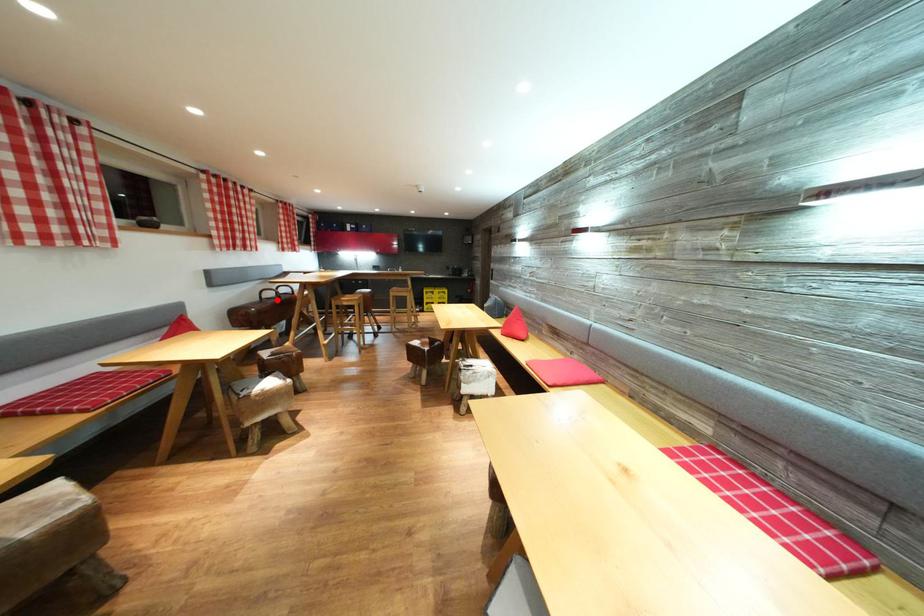
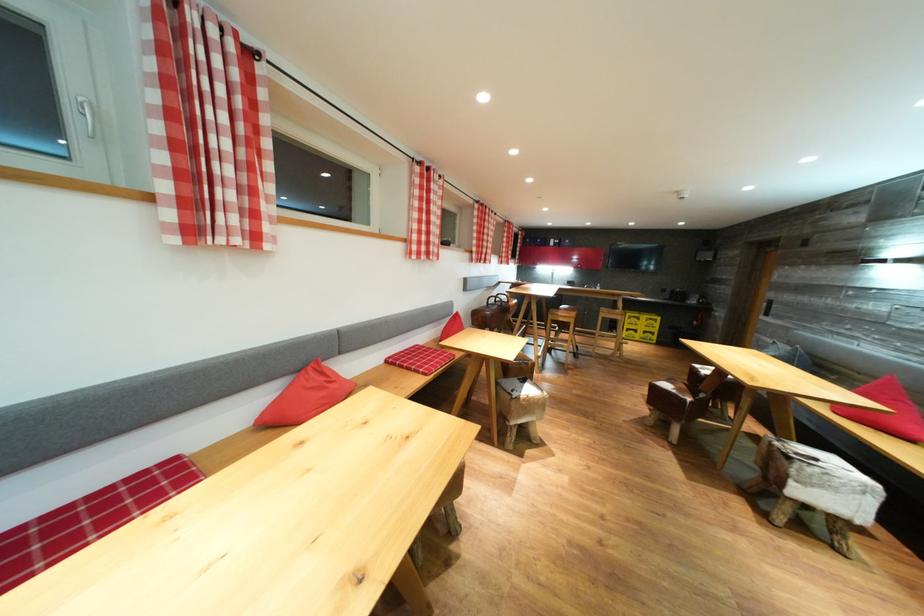
Where in the second image is the point corresponding to the highlighted location from the first image?

(499, 306)